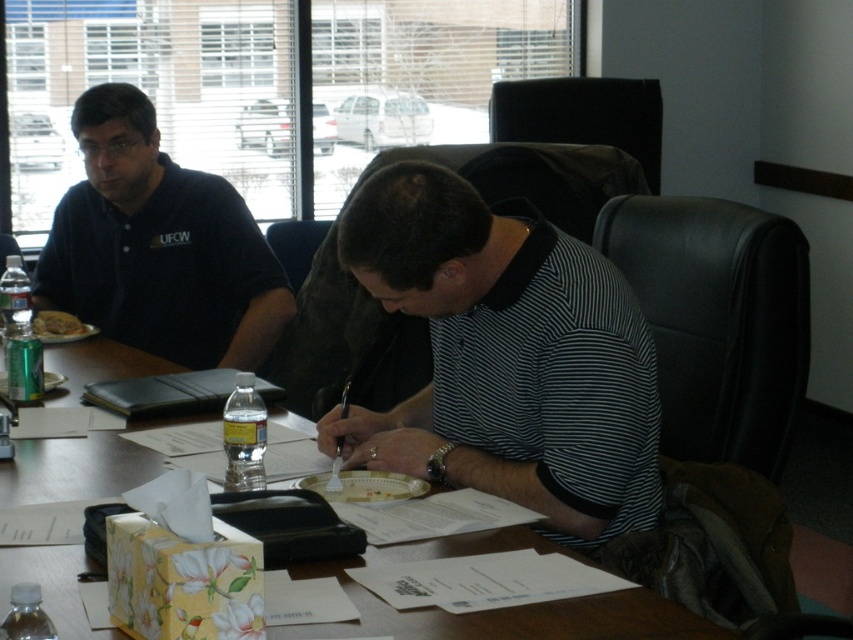
Question: Which object is positioned farthest from the black striped shirt at center?

Choices:
 (A) black leather folder at center
 (B) wooden table at center
 (C) matte black polo shirt at left

Answer: (C)

Question: Which point is closer to the camera?

Choices:
 (A) black striped shirt at center
 (B) black leather folder at center

Answer: (A)

Question: Based on their relative distances, which object is farther from the black striped shirt at center?

Choices:
 (A) matte black polo shirt at left
 (B) black leather folder at center

Answer: (A)

Question: Is black striped shirt at center wider than black leather folder at center?

Choices:
 (A) yes
 (B) no

Answer: (A)

Question: Where is black striped shirt at center located in relation to matte black polo shirt at left in the image?

Choices:
 (A) above
 (B) below

Answer: (B)

Question: Is matte black polo shirt at left thinner than black leather folder at center?

Choices:
 (A) no
 (B) yes

Answer: (A)